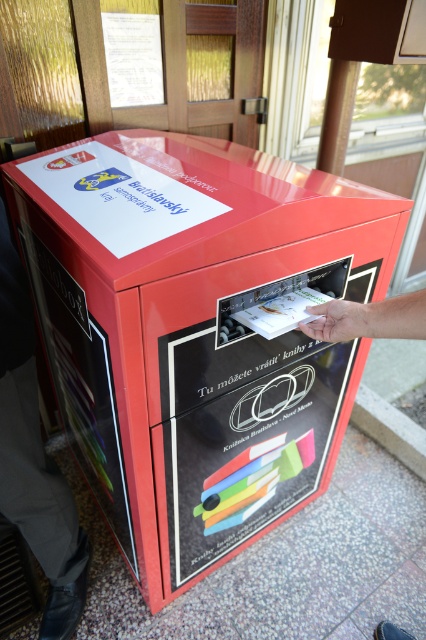
Question: Observing the image, what is the correct spatial positioning of gray fabric pants at lower left in reference to white matte hand at center?

Choices:
 (A) left
 (B) right

Answer: (A)

Question: Which object is closer to the camera taking this photo?

Choices:
 (A) white matte hand at center
 (B) gray fabric pants at lower left
 (C) skinny hand at center
 (D) metallic red atm at center

Answer: (C)

Question: Which object is closer to the camera taking this photo?

Choices:
 (A) metallic red atm at center
 (B) gray fabric pants at lower left
 (C) white matte hand at center

Answer: (A)

Question: Can you confirm if metallic red atm at center is smaller than white matte hand at center?

Choices:
 (A) no
 (B) yes

Answer: (A)

Question: Where is skinny hand at center located in relation to white matte hand at center in the image?

Choices:
 (A) above
 (B) below

Answer: (A)

Question: Which of the following is the closest to the observer?

Choices:
 (A) metallic red atm at center
 (B) skinny hand at center
 (C) gray fabric pants at lower left
 (D) white matte hand at center

Answer: (B)